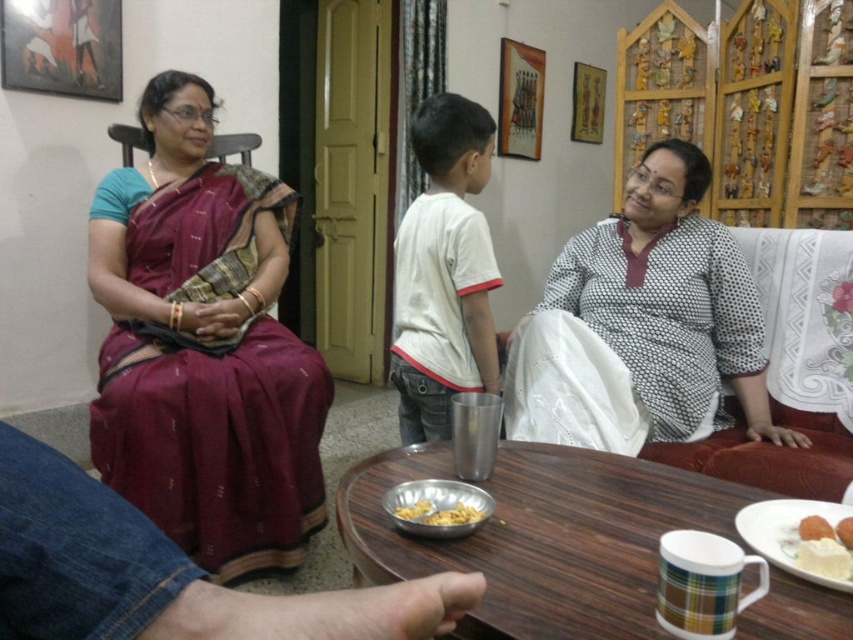
Who is more distant from viewer, [358,540] or [688,324]?

Positioned behind is point [688,324].

Is wooden table at center above white dotted fabric at right?

No, wooden table at center is not above white dotted fabric at right.

Identify the location of wooden table at center. The image size is (853, 640). (543, 536).

What do you see at coordinates (202, 349) in the screenshot? I see `maroon silk saree at left` at bounding box center [202, 349].

Image resolution: width=853 pixels, height=640 pixels. Describe the element at coordinates (202, 349) in the screenshot. I see `maroon silk saree at left` at that location.

The width and height of the screenshot is (853, 640). What are the coordinates of `maroon silk saree at left` in the screenshot? It's located at (202, 349).

Who is positioned more to the right, shiny metallic bowl at center or golden textured rice at center?

Positioned to the right is shiny metallic bowl at center.

Is shiny metallic bowl at center taller than golden textured rice at center?

Correct, shiny metallic bowl at center is much taller as golden textured rice at center.

Who is more forward, (445, 516) or (425, 500)?

Point (445, 516) is more forward.

Where is `shiny metallic bowl at center`? This screenshot has height=640, width=853. shiny metallic bowl at center is located at coordinates (439, 513).